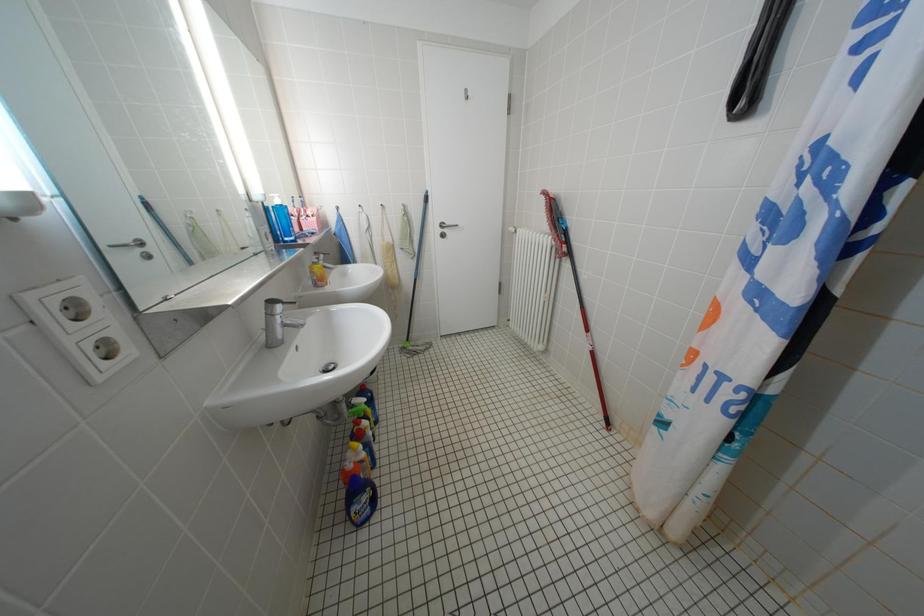
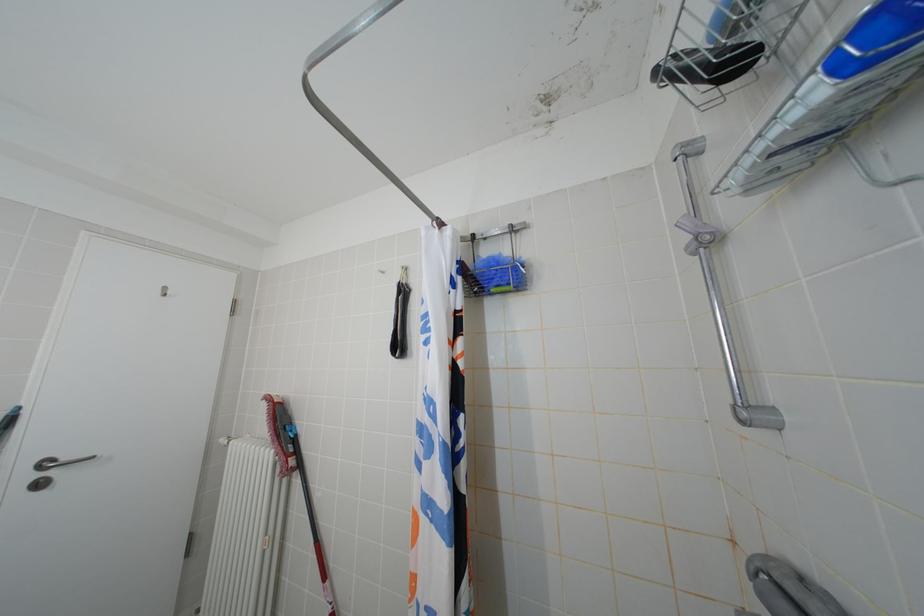
First-person continuous shooting, in which direction is the camera rotating?

The camera rotated toward right-up.